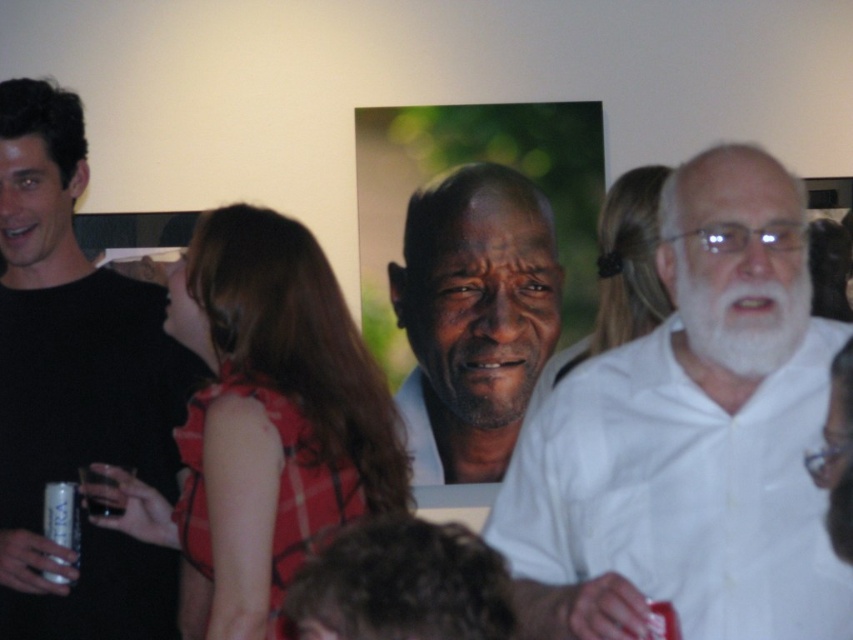
Question: Can you confirm if white matte shirt at right is bigger than gray matte beard at center?

Choices:
 (A) no
 (B) yes

Answer: (B)

Question: Considering the real-world distances, which object is farthest from the matte white face at center?

Choices:
 (A) black matte shirt at left
 (B) white matte shirt at right
 (C) whitehairbeard at right

Answer: (C)

Question: Can you confirm if black matte shirt at left is positioned to the left of matte white face at center?

Choices:
 (A) no
 (B) yes

Answer: (B)

Question: Which object is positioned farthest from the white matte shirt at right?

Choices:
 (A) matte white face at center
 (B) whitehairbeard at right
 (C) black matte shirt at left
 (D) gray matte beard at center

Answer: (A)

Question: Which point is farther to the camera?

Choices:
 (A) (503, 280)
 (B) (756, 280)
 (C) (120, 333)

Answer: (A)

Question: Is matte white face at center thinner than whitehairbeard at right?

Choices:
 (A) no
 (B) yes

Answer: (A)